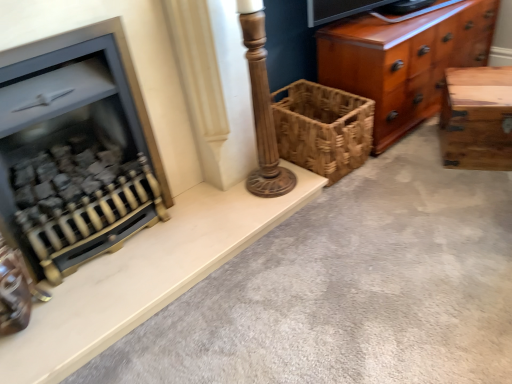
Locate an element on the screen. This screenshot has height=384, width=512. vacant area that lies between natural wood trunk at right and white marble fireplace at left is located at coordinates (352, 213).